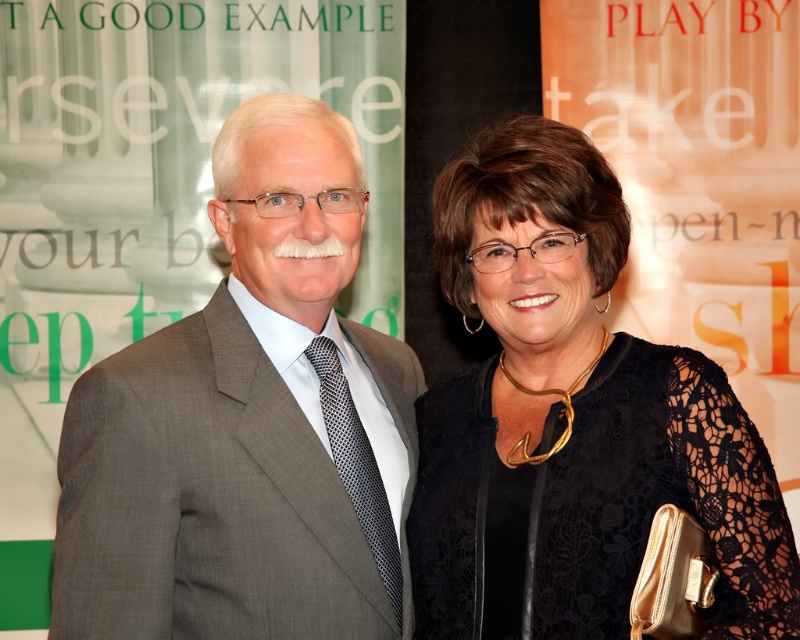
Question: Which point is farther to the camera?

Choices:
 (A) (76, 536)
 (B) (729, 600)

Answer: (B)

Question: Among these points, which one is farthest from the camera?

Choices:
 (A) (220, 404)
 (B) (736, 468)

Answer: (A)

Question: Is gray suit at center bigger than black lace dress at center?

Choices:
 (A) no
 (B) yes

Answer: (B)

Question: Can you confirm if gray suit at center is positioned to the right of black lace dress at center?

Choices:
 (A) no
 (B) yes

Answer: (A)

Question: Considering the relative positions of gray suit at center and black lace dress at center in the image provided, where is gray suit at center located with respect to black lace dress at center?

Choices:
 (A) left
 (B) right

Answer: (A)

Question: Which point is closer to the camera taking this photo?

Choices:
 (A) (296, 632)
 (B) (536, 436)

Answer: (A)